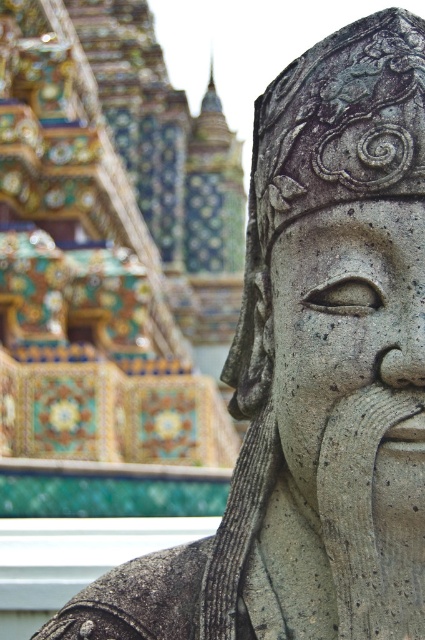
Which is above, gray stone head at center or gray stone face at center?

gray stone head at center

Is gray stone head at center smaller than gray stone face at center?

Actually, gray stone head at center might be larger than gray stone face at center.

Who is more forward, (x=243, y=417) or (x=407, y=257)?

Point (x=407, y=257) is in front.

Where is `gray stone head at center`? The image size is (425, 640). gray stone head at center is located at coordinates (328, 212).